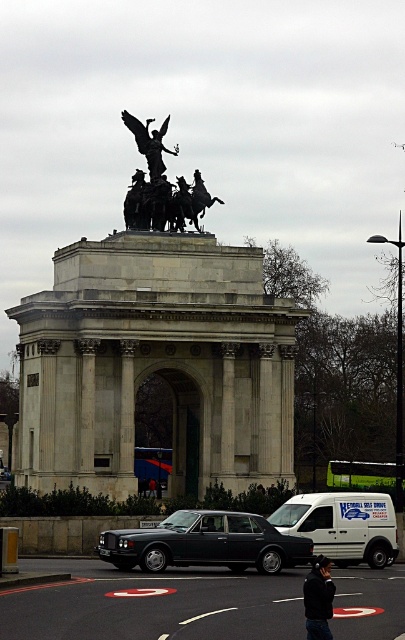
Question: Which object is farther from the camera taking this photo?

Choices:
 (A) polished bronze statue at upper center
 (B) shiny black car at center
 (C) white matte van at center
 (D) black fabric jacket at lower center

Answer: (A)

Question: Does shiny black car at center have a smaller size compared to white matte van at center?

Choices:
 (A) yes
 (B) no

Answer: (B)

Question: Which of the following is the closest to the observer?

Choices:
 (A) bronze statue at center
 (B) white matte van at center
 (C) polished bronze statue at upper center

Answer: (B)

Question: Does white matte van at center have a smaller size compared to polished bronze statue at upper center?

Choices:
 (A) yes
 (B) no

Answer: (B)

Question: Is shiny black car at center to the right of white matte van at center from the viewer's perspective?

Choices:
 (A) no
 (B) yes

Answer: (A)

Question: Which point is farther to the camera?

Choices:
 (A) shiny black car at center
 (B) white matte van at center

Answer: (B)